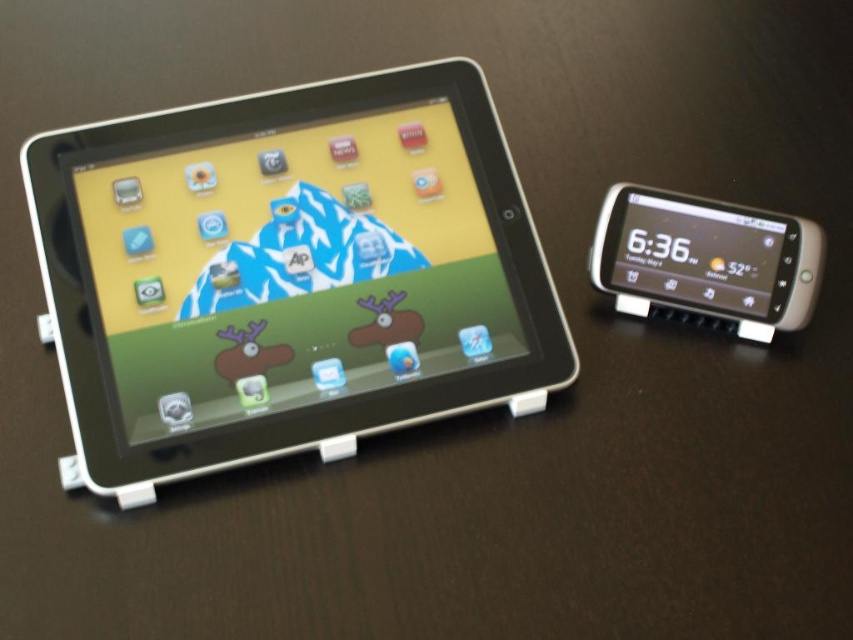
Who is positioned more to the left, black plastic tablet at left or white glossy phone at right?

From the viewer's perspective, black plastic tablet at left appears more on the left side.

Does black plastic tablet at left appear on the left side of white glossy phone at right?

Yes, black plastic tablet at left is to the left of white glossy phone at right.

Does point (204, 204) come behind point (750, 310)?

Yes.

At what (x,y) coordinates should I click in order to perform the action: click on black plastic tablet at left. Please return your answer as a coordinate pair (x, y). Looking at the image, I should click on (289, 273).